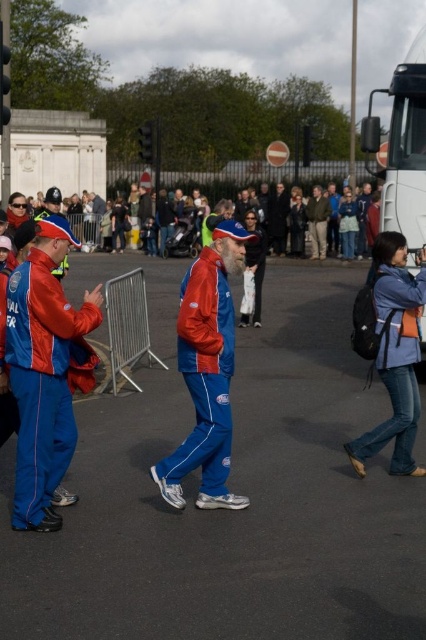
Who is lower down, matte blue tracksuit at center or dark brown leather jacket at center?

matte blue tracksuit at center is lower down.

Does matte blue tracksuit at center appear over dark brown leather jacket at center?

No, matte blue tracksuit at center is not above dark brown leather jacket at center.

Who is more forward, (192, 358) or (307, 216)?

Point (192, 358)

Locate an element on the screen. This screenshot has width=426, height=640. matte blue tracksuit at center is located at coordinates (207, 372).

Is matte blue jumpsuit at left to the left of dark brown leather jacket at center from the viewer's perspective?

Yes, matte blue jumpsuit at left is to the left of dark brown leather jacket at center.

Is matte blue jumpsuit at left closer to camera compared to dark brown leather jacket at center?

Yes, it is in front of dark brown leather jacket at center.

What do you see at coordinates (46, 371) in the screenshot? Image resolution: width=426 pixels, height=640 pixels. I see `matte blue jumpsuit at left` at bounding box center [46, 371].

Where is `matte blue jumpsuit at left`? The image size is (426, 640). matte blue jumpsuit at left is located at coordinates (46, 371).

Based on the photo, measure the distance between matte blue tracksuit at center and matte blue jacket at center.

A distance of 12.29 meters exists between matte blue tracksuit at center and matte blue jacket at center.

What do you see at coordinates (207, 372) in the screenshot?
I see `matte blue tracksuit at center` at bounding box center [207, 372].

You are a GUI agent. You are given a task and a screenshot of the screen. Output one action in this format:
    pyautogui.click(x=<x>, y=<y>)
    Task: Click on the matte blue tracksuit at center
    This screenshot has height=640, width=426.
    Given the screenshot: What is the action you would take?
    pyautogui.click(x=207, y=372)